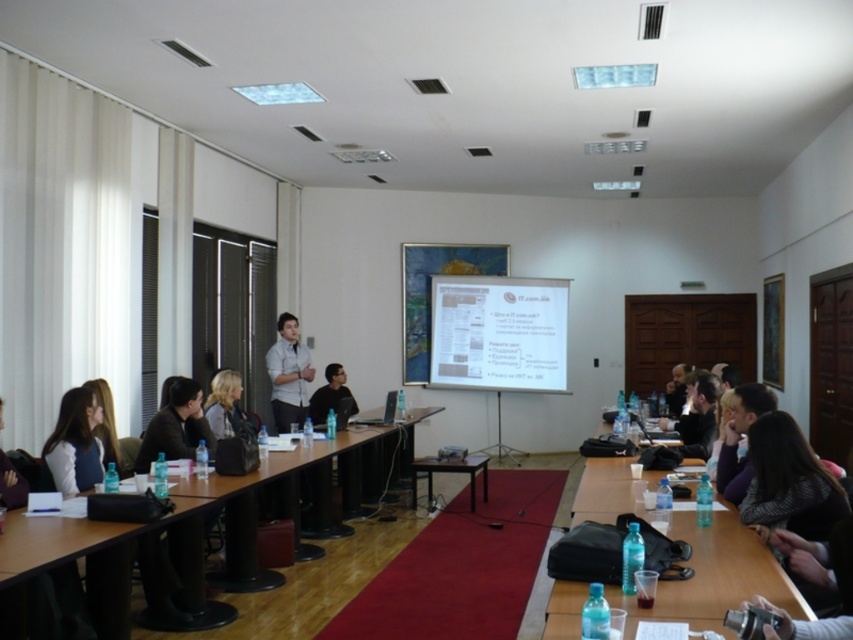
You are an attendee at the conference and want to grab a water bottle from the lower right table without moving from your seat. Can you reach the clear plastic water bottles at lower right before the dark gray sweater at center blocks your path?

The clear plastic water bottles at lower right is closer to the viewer than dark gray sweater at center, so you can reach the clear plastic water bottles at lower right before the dark gray sweater at center blocks your path.

You are an attendee in the conference room and notice two people at the center. One is wearing a matte black jacket at center and the other a matte white shirt at center. Based on their positions, which person is closer to you?

The matte black jacket at center is closer to you because it is positioned in front of the matte white shirt at center.

Based on the photo, you are an attendee at the conference and you want to place a name tag on the wooden table at lower left. However, you notice the dark gray sweater at center is in the way. Can you move the sweater to access the table?

The wooden table at lower left is located below the dark gray sweater at center, so moving the sweater would allow access to the table.